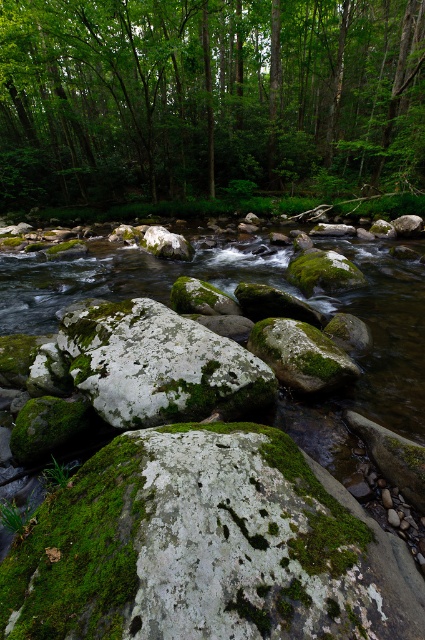
You are standing at the point with coordinates point [206,96] in the forest scene. What object is located exactly at that point?

The point [206,96] corresponds to the green leafy tree at upper center.

You are standing in the forest and want to take a photo of the green leafy tree at upper center and the green mossy rock at center. Which object should you focus on first if you want both to be in clear focus?

You should focus on the green mossy rock at center first because it is closer to you than the green leafy tree at upper center, which is further away. This way, both objects will be in clear focus.

You are a hiker trying to cross the stream in the forest. You see the green leafy tree at upper center and the green mossy rock at center. Which object is higher up in the scene?

The green leafy tree at upper center is located above the green mossy rock at center, so it is higher up in the scene.